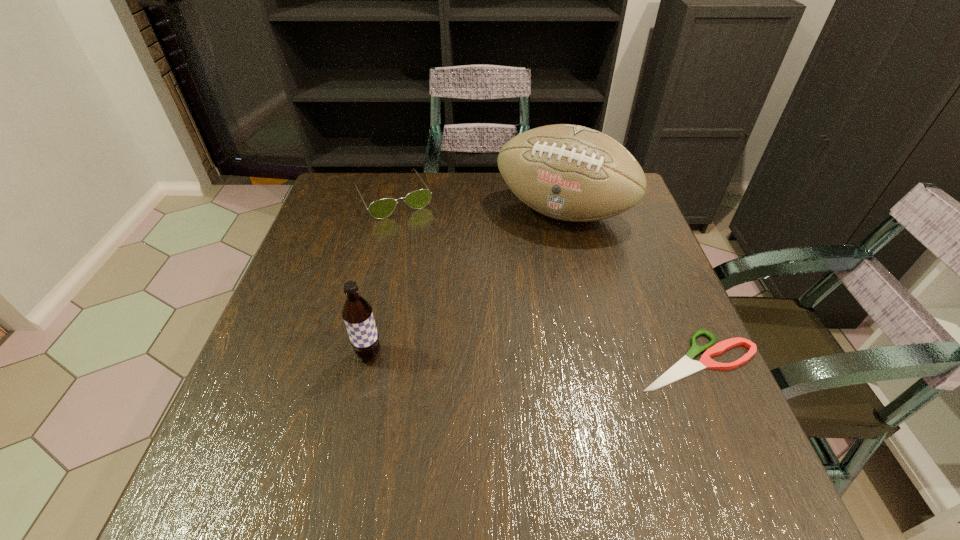
The height and width of the screenshot is (540, 960). What are the coordinates of `free point between the sunglasses and the scissors` in the screenshot? It's located at (544, 279).

This screenshot has width=960, height=540. What are the coordinates of `free space between the tallest object and the second shortest object` in the screenshot? It's located at (478, 205).

You are a GUI agent. You are given a task and a screenshot of the screen. Output one action in this format:
    pyautogui.click(x=<x>, y=<y>)
    Task: Click on the vacant space that's between the football (American) and the scissors
    
    Given the screenshot: What is the action you would take?
    pyautogui.click(x=630, y=286)

Where is `free space between the shortest object and the tallest object`? This screenshot has width=960, height=540. free space between the shortest object and the tallest object is located at coordinates (630, 286).

This screenshot has width=960, height=540. Identify the location of free space between the scissors and the football (American). (630, 286).

Locate an element on the screen. object that can be found as the second closest to the third tallest object is located at coordinates (357, 313).

Identify which object is the third nearest to the scissors. Please provide its 2D coordinates. Your answer should be formatted as a tuple, i.e. [(x, y)], where the tuple contains the x and y coordinates of a point satisfying the conditions above.

[(380, 209)]

The image size is (960, 540). In order to click on blank area in the image that satisfies the following two spatial constraints: 1. on the front side of the shortest object; 2. on the right side of the third tallest object in this screenshot , I will do `click(352, 360)`.

Identify the location of free space that satisfies the following two spatial constraints: 1. on the back side of the root beer; 2. on the right side of the football (American). (400, 212).

Locate an element on the screen. The width and height of the screenshot is (960, 540). vacant position in the image that satisfies the following two spatial constraints: 1. on the front side of the shortest object; 2. on the right side of the root beer is located at coordinates (368, 360).